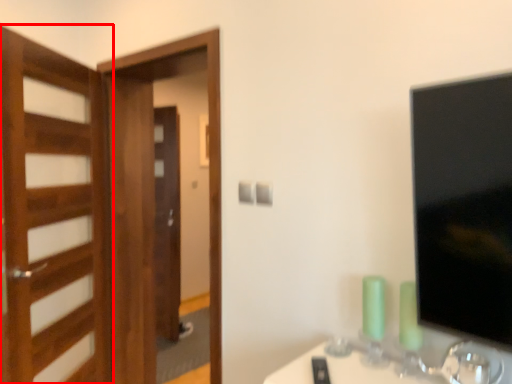
Question: From the image's perspective, what is the correct spatial relationship of door (annotated by the red box) in relation to screen door?

Choices:
 (A) above
 (B) below

Answer: (A)